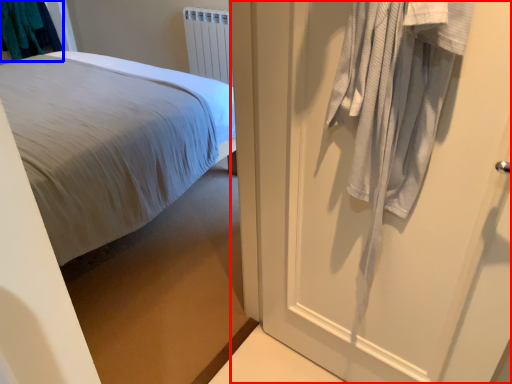
Question: Which point is further to the camera, door (highlighted by a red box) or laundry (highlighted by a blue box)?

Choices:
 (A) door
 (B) laundry

Answer: (B)